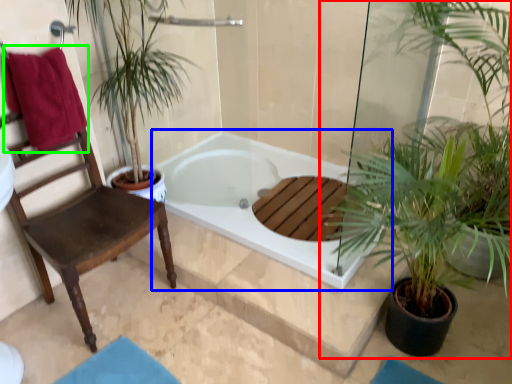
Question: Based on their relative distances, which object is nearer to houseplant (highlighted by a red box)? Choose from bathtub (highlighted by a blue box) and beach towel (highlighted by a green box).

Choices:
 (A) bathtub
 (B) beach towel

Answer: (A)